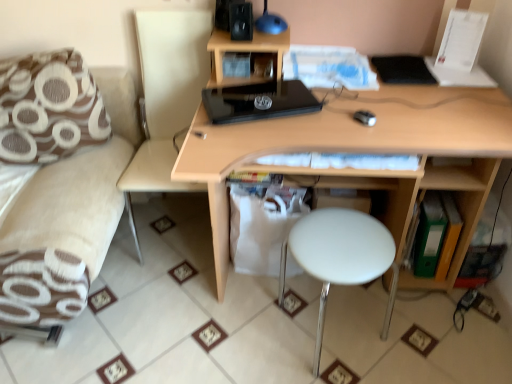
Locate an element on the screen. Image resolution: width=512 pixels, height=384 pixels. vacant space to the left of black matte speaker at upper center is located at coordinates (220, 40).